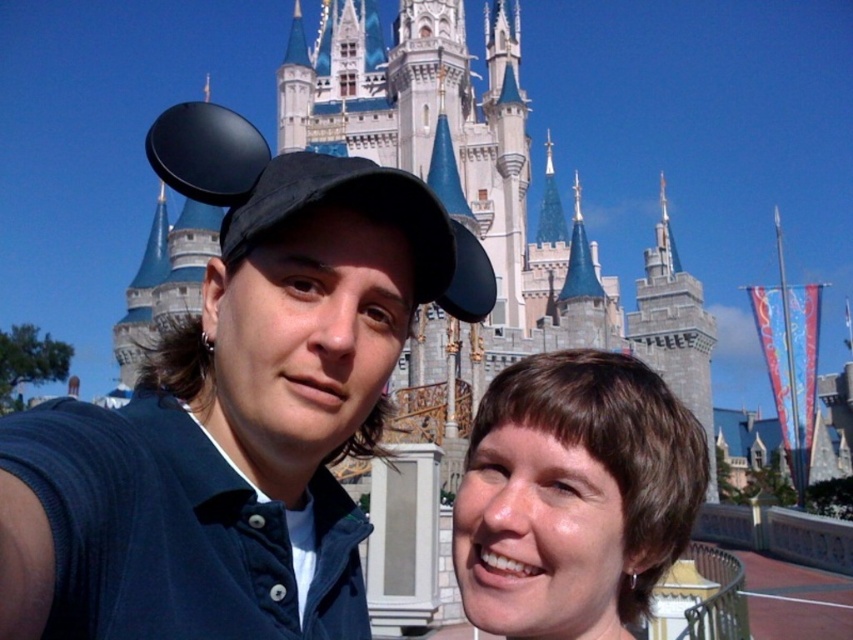
Can you confirm if white stone castle at center is shorter than brown hair at center?

No, white stone castle at center is not shorter than brown hair at center.

Does white stone castle at center have a lesser width compared to brown hair at center?

In fact, white stone castle at center might be wider than brown hair at center.

Measure the distance between point (x=178, y=250) and camera.

A distance of 123.07 meters exists between point (x=178, y=250) and camera.

Identify the location of white stone castle at center. Image resolution: width=853 pixels, height=640 pixels. (486, 189).

Does brown hair at center appear under black fabric baseball cap at upper center?

Correct, brown hair at center is located below black fabric baseball cap at upper center.

Is brown hair at center thinner than black fabric baseball cap at upper center?

Yes.

Is point (459, 540) closer to camera compared to point (183, 166)?

No, (459, 540) is behind (183, 166).

The image size is (853, 640). Identify the location of brown hair at center. (573, 496).

Does matte black cap at center appear over black fabric baseball cap at upper center?

No.

Between point (267, 547) and point (213, 170), which one is positioned behind?

The point (213, 170) is behind.

Where is `matte black cap at center`? matte black cap at center is located at coordinates (231, 429).